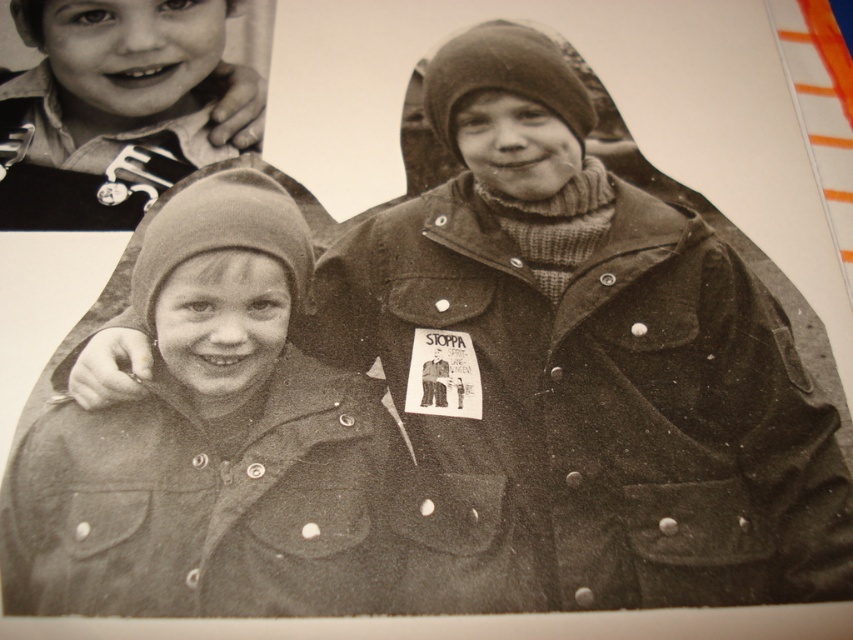
Question: Does coarse woolen hat at center have a larger size compared to matte black shirt at upper left?

Choices:
 (A) yes
 (B) no

Answer: (A)

Question: Is coarse woolen hat at center thinner than matte black shirt at upper left?

Choices:
 (A) no
 (B) yes

Answer: (A)

Question: Which object appears farthest from the camera in this image?

Choices:
 (A) matte black shirt at upper left
 (B) coarse woolen hat at center

Answer: (A)

Question: Which object is closer to the camera taking this photo?

Choices:
 (A) matte black shirt at upper left
 (B) coarse woolen hat at center

Answer: (B)

Question: Is coarse woolen hat at center to the left of matte black shirt at upper left from the viewer's perspective?

Choices:
 (A) yes
 (B) no

Answer: (B)